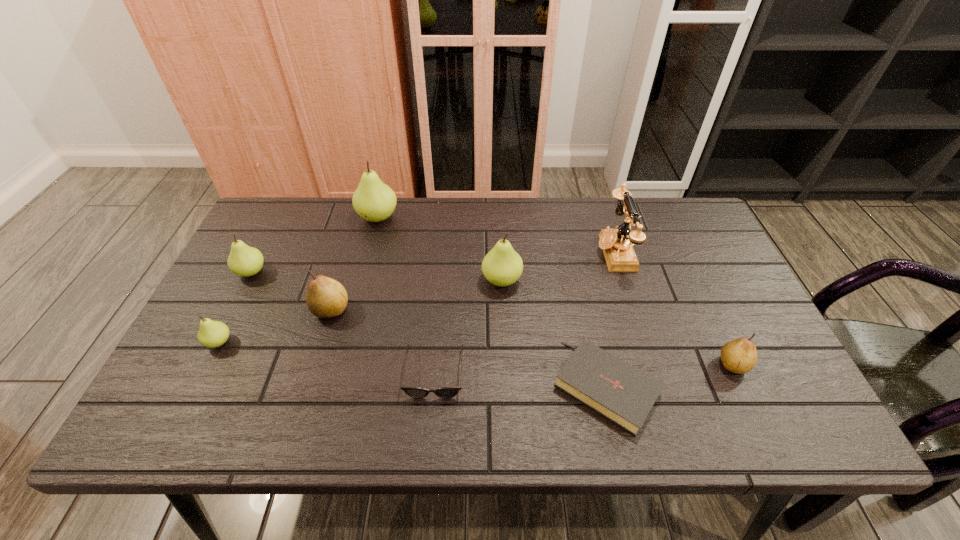
This screenshot has width=960, height=540. I want to click on the right brown pear, so click(739, 356).

Where is `sunglasses`? The width and height of the screenshot is (960, 540). sunglasses is located at coordinates (415, 392).

The height and width of the screenshot is (540, 960). I want to click on the fifth object from left to right, so click(x=415, y=392).

This screenshot has height=540, width=960. Identify the location of Bible. (620, 392).

Image resolution: width=960 pixels, height=540 pixels. Identify the location of vacant space located 0.400m on the front of the tallest pear. click(348, 336).

The height and width of the screenshot is (540, 960). Identify the location of vacant area located on the dial of the telephone. (525, 252).

The image size is (960, 540). Identify the location of free point located 0.190m on the dial of the telephone. (532, 252).

Locate an element on the screen. vacant area situated 0.120m on the dial of the telephone is located at coordinates (556, 252).

At what (x,y) coordinates should I click in order to perform the action: click on vacant space located 0.080m on the left of the second biggest green pear. Please return your answer as a coordinate pair (x, y). This screenshot has height=540, width=960. Looking at the image, I should click on (452, 280).

Where is `free location located on the right of the farther brown pear`? free location located on the right of the farther brown pear is located at coordinates (501, 309).